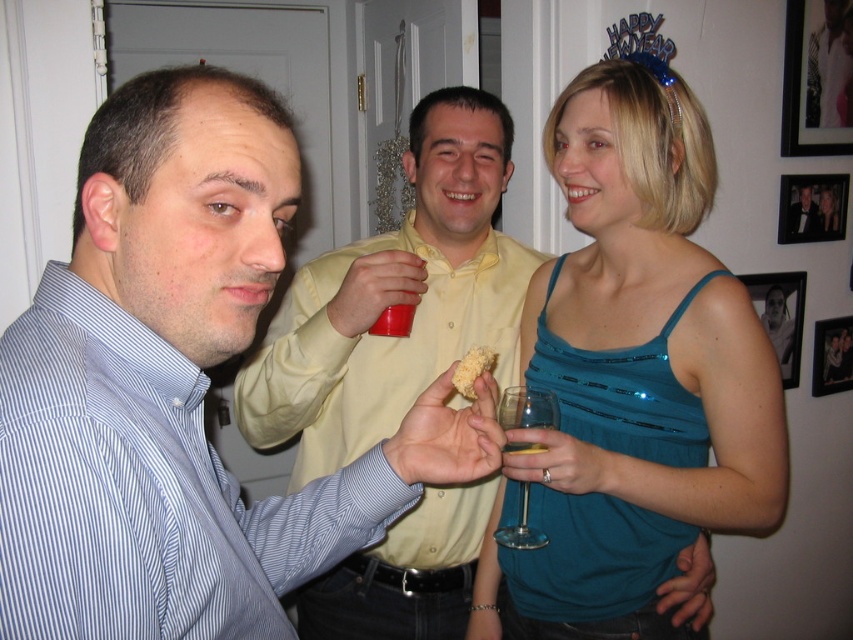
Locate an element on the screen. This screenshot has width=853, height=640. blue striped shirt at left is located at coordinates (178, 388).

Is point (813, 216) more distant than point (798, 300)?

No, it is in front of (798, 300).

Is matte black frame at upper right to the left of metallic silver photo frame at upper right from the viewer's perspective?

No, matte black frame at upper right is not to the left of metallic silver photo frame at upper right.

Who is more distant from viewer, (813, 225) or (778, 296)?

Positioned behind is point (813, 225).

Where is `matte black frame at upper right`? This screenshot has height=640, width=853. matte black frame at upper right is located at coordinates (811, 208).

Which is in front, point (833, 32) or point (792, 224)?

Point (792, 224) is more forward.

Is black glossy picture frame at upper right to the right of black satin tuxedo at upper right from the viewer's perspective?

Yes, black glossy picture frame at upper right is to the right of black satin tuxedo at upper right.

Measure the distance between black glossy picture frame at upper right and camera.

black glossy picture frame at upper right is 6.64 feet from camera.

This screenshot has height=640, width=853. I want to click on black glossy picture frame at upper right, so click(817, 77).